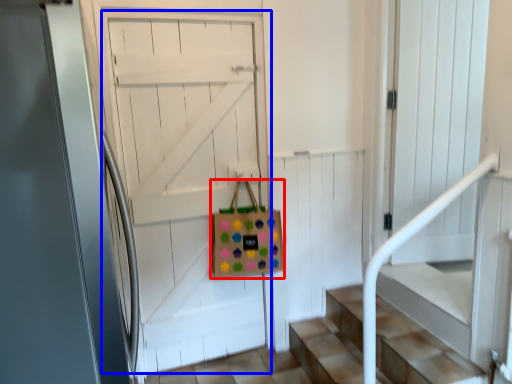
Question: Which of the following is the farthest to the observer, shopping bag (highlighted by a red box) or door (highlighted by a blue box)?

Choices:
 (A) shopping bag
 (B) door

Answer: (A)